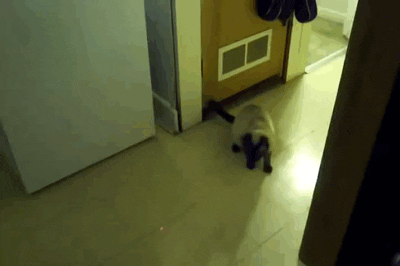
Where is `floor, tiles`? This screenshot has height=266, width=400. floor, tiles is located at coordinates (106, 241).